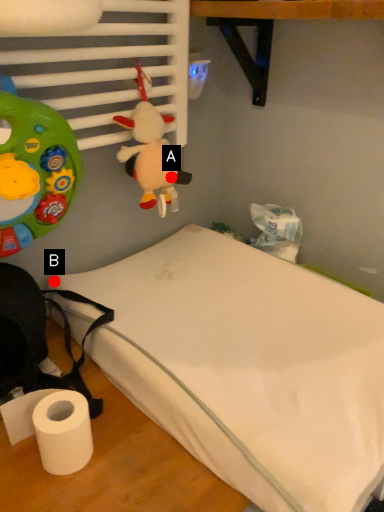
Question: Two points are circled on the image, labeled by A and B beside each circle. Which point is further to the camera?

Choices:
 (A) A is further
 (B) B is further

Answer: (B)